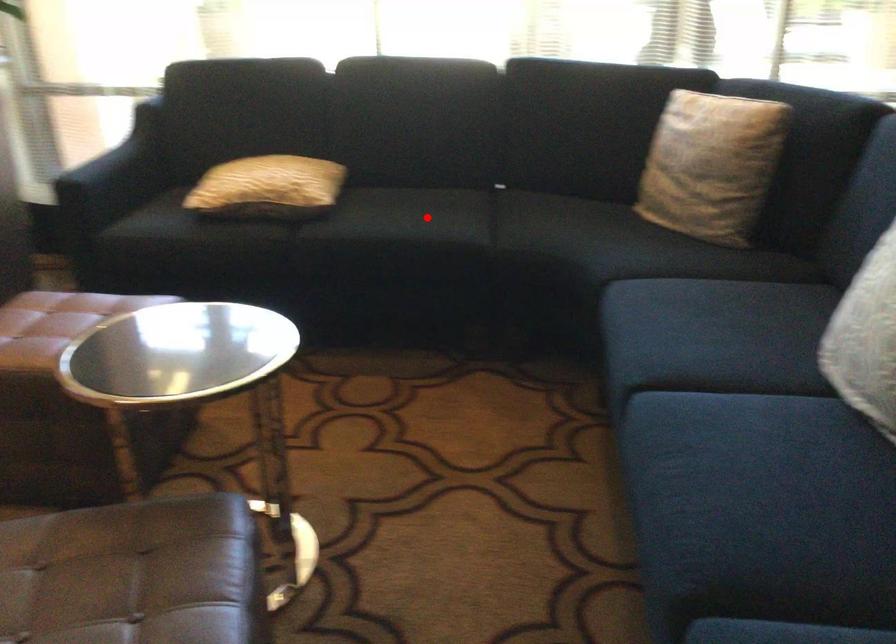
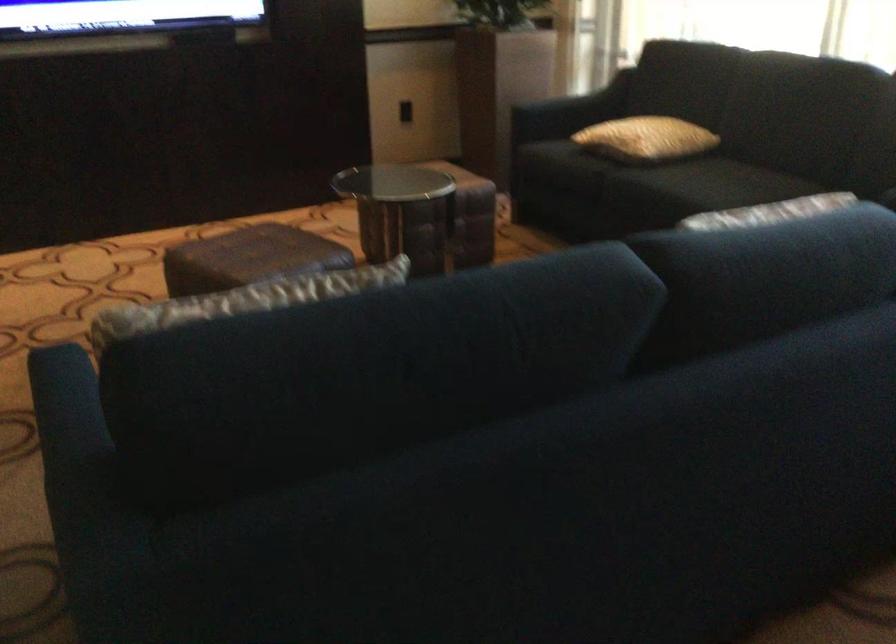
The point at the highlighted location is marked in the first image. Where is the corresponding point in the second image?

(709, 184)